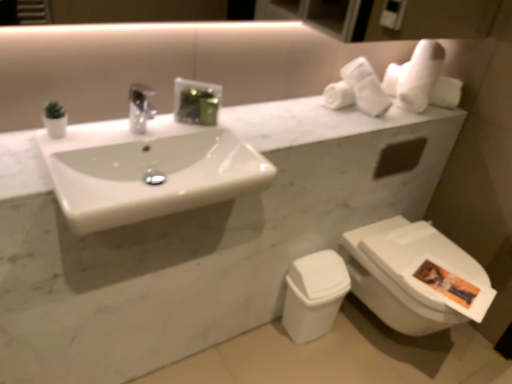
The width and height of the screenshot is (512, 384). Find the location of `free point in front of white plastic toilet bowl at lower right`. free point in front of white plastic toilet bowl at lower right is located at coordinates (304, 363).